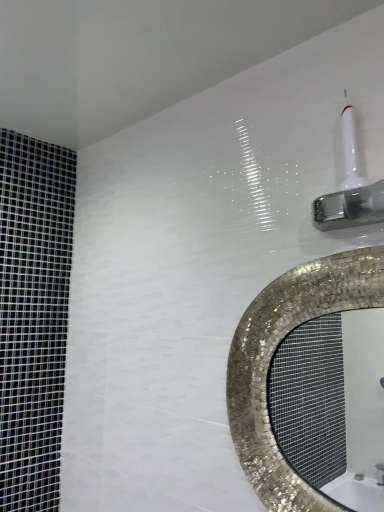
Image resolution: width=384 pixels, height=512 pixels. What do you see at coordinates (350, 189) in the screenshot?
I see `white glossy shower head at upper right` at bounding box center [350, 189].

You are a GUI agent. You are given a task and a screenshot of the screen. Output one action in this format:
    pyautogui.click(x=<x>, y=<y>)
    Task: Click on the white glossy shower head at upper right
    
    Given the screenshot: What is the action you would take?
    pyautogui.click(x=350, y=189)

What is the approximate width of white glossy shower head at upper right?

5.48 centimeters.

Measure the distance between shiny mosaic mirror at upper right and camera.

shiny mosaic mirror at upper right is 2.41 meters away from camera.

What do you see at coordinates (329, 401) in the screenshot?
I see `shiny mosaic mirror at upper right` at bounding box center [329, 401].

At what (x,y) coordinates should I click in order to perform the action: click on shiny mosaic mirror at upper right. Please return your answer as a coordinate pair (x, y). The height and width of the screenshot is (512, 384). Looking at the image, I should click on (329, 401).

You are a GUI agent. You are given a task and a screenshot of the screen. Output one action in this format:
    pyautogui.click(x=<x>, y=<y>)
    Task: Click on the white glossy shower head at upper right
    This screenshot has height=512, width=384.
    Given the screenshot: What is the action you would take?
    350,189

Is white glossy shower head at upper right to the left or to the right of shiny mosaic mirror at upper right in the image?

Clearly, white glossy shower head at upper right is on the right of shiny mosaic mirror at upper right in the image.

Considering their positions, is white glossy shower head at upper right located in front of or behind shiny mosaic mirror at upper right?

Clearly, white glossy shower head at upper right is in front of shiny mosaic mirror at upper right.

Is point (350, 149) closer to camera compared to point (302, 348)?

Yes.

From the image's perspective, does white glossy shower head at upper right appear lower than shiny mosaic mirror at upper right?

No, from the image's perspective, white glossy shower head at upper right is not beneath shiny mosaic mirror at upper right.

From a real-world perspective, is white glossy shower head at upper right on shiny mosaic mirror at upper right?

Yes.

Between white glossy shower head at upper right and shiny mosaic mirror at upper right, which one has larger width?

With larger width is white glossy shower head at upper right.

Considering the sizes of objects white glossy shower head at upper right and shiny mosaic mirror at upper right in the image provided, who is shorter, white glossy shower head at upper right or shiny mosaic mirror at upper right?

With less height is white glossy shower head at upper right.

Between white glossy shower head at upper right and shiny mosaic mirror at upper right, which one has larger size?

shiny mosaic mirror at upper right.

Would you say white glossy shower head at upper right contains shiny mosaic mirror at upper right?

No, white glossy shower head at upper right does not contain shiny mosaic mirror at upper right.

Does white glossy shower head at upper right touch shiny mosaic mirror at upper right?

No, white glossy shower head at upper right is not with shiny mosaic mirror at upper right.

Is shiny mosaic mirror at upper right at the back of white glossy shower head at upper right?

white glossy shower head at upper right is not turned away from shiny mosaic mirror at upper right.

What's the angular difference between white glossy shower head at upper right and shiny mosaic mirror at upper right's facing directions?

The angular difference between white glossy shower head at upper right and shiny mosaic mirror at upper right is 0.00273 degrees.

This screenshot has width=384, height=512. I want to click on mirror below the white glossy shower head at upper right (from the image's perspective), so click(329, 401).

Considering the positions of objects shiny mosaic mirror at upper right and white glossy shower head at upper right in the image provided, who is more to the left, shiny mosaic mirror at upper right or white glossy shower head at upper right?

From the viewer's perspective, shiny mosaic mirror at upper right appears more on the left side.

Is shiny mosaic mirror at upper right behind white glossy shower head at upper right?

Yes, shiny mosaic mirror at upper right is further from the camera.

Does point (354, 501) appear closer or farther from the camera than point (348, 172)?

Point (354, 501).

From the image's perspective, is shiny mosaic mirror at upper right located above or below white glossy shower head at upper right?

shiny mosaic mirror at upper right is situated lower than white glossy shower head at upper right in the image.

From a real-world perspective, is shiny mosaic mirror at upper right on top of white glossy shower head at upper right?

Actually, shiny mosaic mirror at upper right is physically below white glossy shower head at upper right in the real world.

Which of these two, shiny mosaic mirror at upper right or white glossy shower head at upper right, is thinner?

Thinner between the two is shiny mosaic mirror at upper right.

Who is taller, shiny mosaic mirror at upper right or white glossy shower head at upper right?

shiny mosaic mirror at upper right.

Which of these two, shiny mosaic mirror at upper right or white glossy shower head at upper right, is bigger?

shiny mosaic mirror at upper right.

Looking at this image, would you say shiny mosaic mirror at upper right is outside white glossy shower head at upper right?

shiny mosaic mirror at upper right is positioned outside white glossy shower head at upper right.

Are shiny mosaic mirror at upper right and white glossy shower head at upper right located far from each other?

Yes, shiny mosaic mirror at upper right and white glossy shower head at upper right are located far from each other.

Is white glossy shower head at upper right at the back of shiny mosaic mirror at upper right?

No, white glossy shower head at upper right is not at the back of shiny mosaic mirror at upper right.

At what (x,y) coordinates should I click in order to perform the action: click on shower above the shiny mosaic mirror at upper right (from the image's perspective). Please return your answer as a coordinate pair (x, y). Looking at the image, I should click on (350, 189).

Identify the location of shower in front of the shiny mosaic mirror at upper right. (350, 189).

I want to click on mirror lying on the left of white glossy shower head at upper right, so click(x=329, y=401).